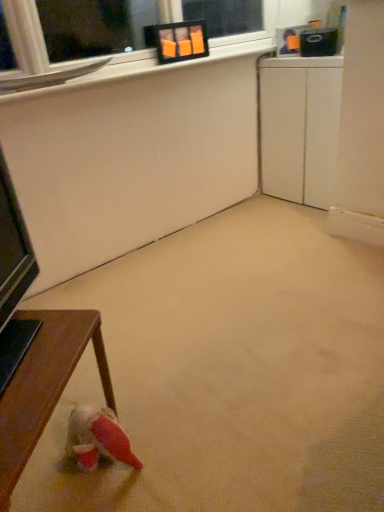
Question: Is wooden table at lower left taller than white matte cabinet at right?

Choices:
 (A) no
 (B) yes

Answer: (A)

Question: Does wooden table at lower left appear on the right side of white matte cabinet at right?

Choices:
 (A) no
 (B) yes

Answer: (A)

Question: Is wooden table at lower left touching white matte cabinet at right?

Choices:
 (A) yes
 (B) no

Answer: (B)

Question: From the image's perspective, is wooden table at lower left beneath white matte cabinet at right?

Choices:
 (A) yes
 (B) no

Answer: (A)

Question: Can you confirm if wooden table at lower left is thinner than white matte cabinet at right?

Choices:
 (A) yes
 (B) no

Answer: (B)

Question: Can you confirm if wooden table at lower left is wider than white matte cabinet at right?

Choices:
 (A) no
 (B) yes

Answer: (B)

Question: Is white matte cabinet at right not within wooden table at lower left?

Choices:
 (A) yes
 (B) no

Answer: (A)

Question: From the image's perspective, is white matte cabinet at right above wooden table at lower left?

Choices:
 (A) yes
 (B) no

Answer: (A)

Question: From the image's perspective, is white matte cabinet at right located beneath wooden table at lower left?

Choices:
 (A) yes
 (B) no

Answer: (B)

Question: Considering the relative positions of white matte cabinet at right and wooden table at lower left in the image provided, is white matte cabinet at right in front of wooden table at lower left?

Choices:
 (A) no
 (B) yes

Answer: (A)

Question: Considering the relative sizes of white matte cabinet at right and wooden table at lower left in the image provided, is white matte cabinet at right bigger than wooden table at lower left?

Choices:
 (A) no
 (B) yes

Answer: (B)

Question: Is white matte cabinet at right next to wooden table at lower left?

Choices:
 (A) no
 (B) yes

Answer: (A)

Question: Does wooden table at lower left come behind beige carpet at center?

Choices:
 (A) yes
 (B) no

Answer: (A)